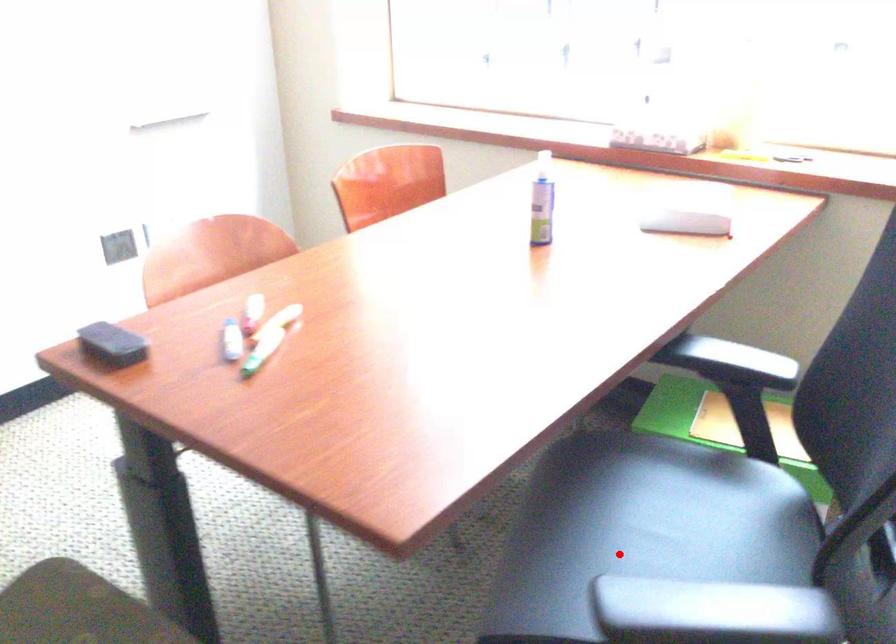
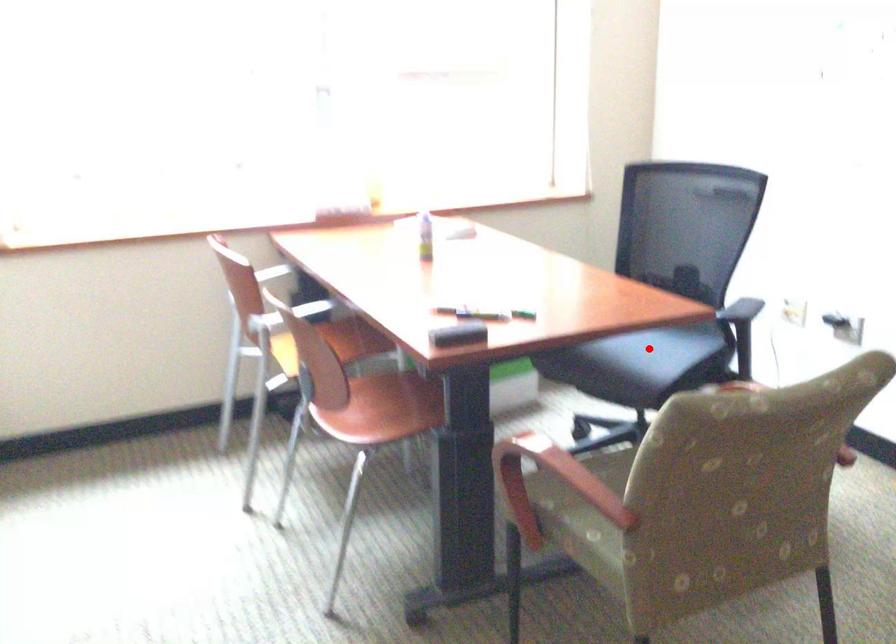
I am providing you with two images of the same scene from different viewpoints. A red point is marked on the first image and another point is marked on the second image. Is the red point in image1 aligned with the point shown in image2?

Yes